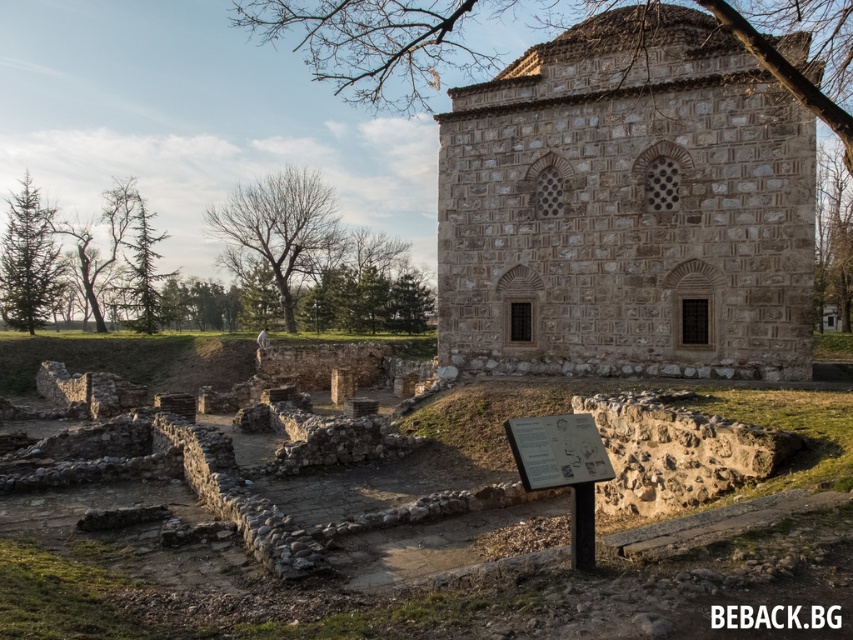
What are the coordinates of the brown stone church at center?

The brown stone church at center is located at coordinates point (627, 208).